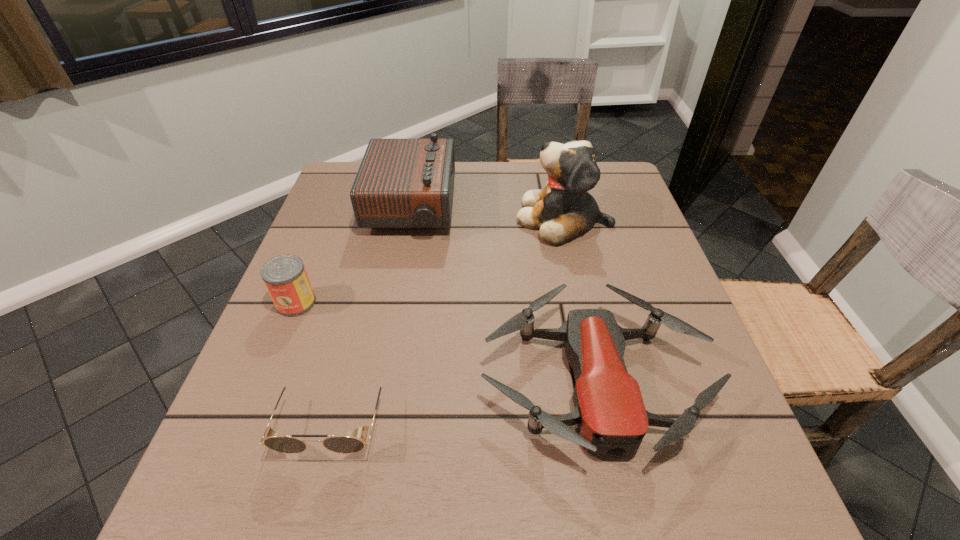
Locate an element on the screen. This screenshot has height=540, width=960. free spot located on the front lenses of the sunglasses is located at coordinates (x=310, y=510).

This screenshot has width=960, height=540. I want to click on puppy situated at the far edge, so click(564, 209).

Where is `radio receiver that is positioned at the far edge`? radio receiver that is positioned at the far edge is located at coordinates (401, 183).

Where is `object located in the near edge section of the desktop`? Image resolution: width=960 pixels, height=540 pixels. object located in the near edge section of the desktop is located at coordinates (611, 417).

Where is `radio receiver present at the left edge`? Image resolution: width=960 pixels, height=540 pixels. radio receiver present at the left edge is located at coordinates (401, 183).

This screenshot has height=540, width=960. Find the location of `can situated at the left edge`. can situated at the left edge is located at coordinates (285, 277).

This screenshot has height=540, width=960. In order to click on sunglasses located at the left edge in this screenshot , I will do `click(340, 444)`.

Where is `puppy located in the right edge section of the desktop`? puppy located in the right edge section of the desktop is located at coordinates (564, 209).

Locate an element on the screen. The height and width of the screenshot is (540, 960). drone positioned at the right edge is located at coordinates (611, 417).

Identify the location of object located in the far left corner section of the desktop. (401, 183).